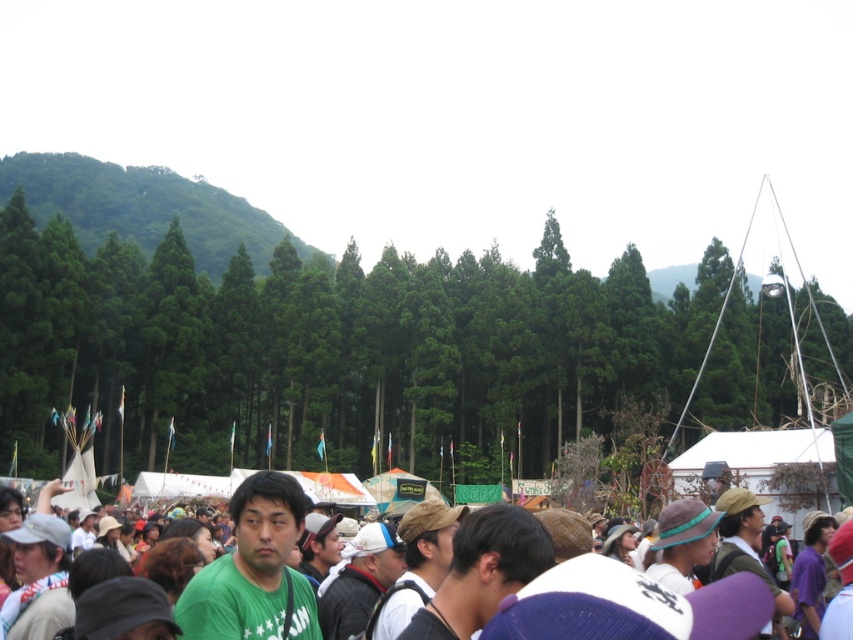
Who is shorter, green fabric crowd at center or green fabric shirt at center?

With less height is green fabric crowd at center.

Is point (223, 627) positioned behind point (463, 508)?

That is False.

Which is behind, point (621, 604) or point (419, 534)?

The point (419, 534) is behind.

The image size is (853, 640). I want to click on green fabric crowd at center, so click(x=486, y=572).

Between green fabric crowd at center and dark green t-shirt at center, which one has less height?

dark green t-shirt at center

Based on the photo, is green fabric crowd at center to the right of dark green t-shirt at center from the viewer's perspective?

Incorrect, green fabric crowd at center is not on the right side of dark green t-shirt at center.

Between point (16, 544) and point (415, 625), which one is positioned behind?

The point (16, 544) is behind.

You are a GUI agent. You are given a task and a screenshot of the screen. Output one action in this format:
    pyautogui.click(x=<x>, y=<y>)
    Task: Click on the green fabric crowd at center
    Image resolution: width=853 pixels, height=640 pixels.
    Given the screenshot: What is the action you would take?
    pyautogui.click(x=486, y=572)

Can you confirm if white matte cap at center is bigger than green fabric shirt at center?

Incorrect, white matte cap at center is not larger than green fabric shirt at center.

Is white matte cap at center taller than green fabric shirt at center?

No.

You are a GUI agent. You are given a task and a screenshot of the screen. Output one action in this format:
    pyautogui.click(x=<x>, y=<y>)
    Task: Click on the white matte cap at center
    Image resolution: width=853 pixels, height=640 pixels.
    Given the screenshot: What is the action you would take?
    click(360, 580)